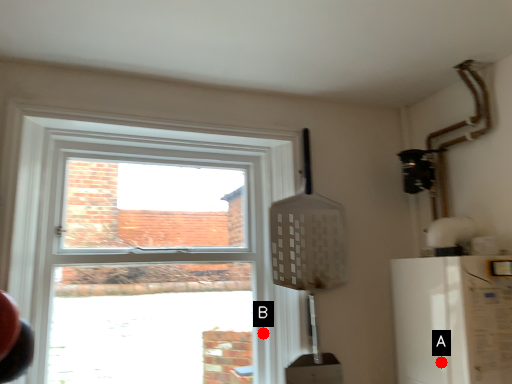
Question: Two points are circled on the image, labeled by A and B beside each circle. Which point is farther to the camera?

Choices:
 (A) A is further
 (B) B is further

Answer: (B)